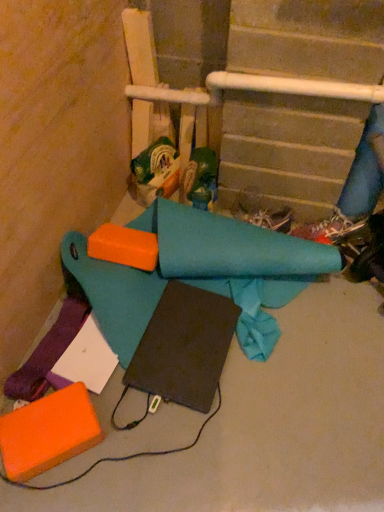
I want to click on empty space that is ontop of black matte notebook at center (from a real-world perspective), so click(190, 336).